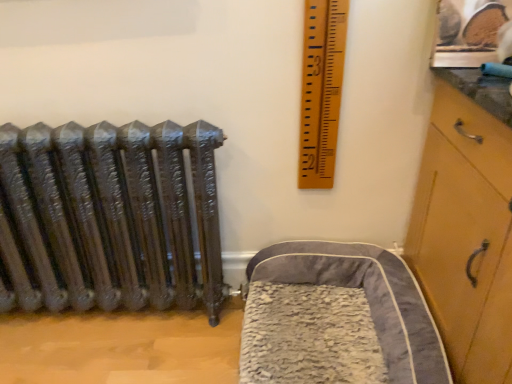
Question: From their relative heights in the image, would you say gray plush pet bed at lower right is taller or shorter than wooden ruler at upper right?

Choices:
 (A) short
 (B) tall

Answer: (A)

Question: Does point (415, 337) appear closer or farther from the camera than point (322, 18)?

Choices:
 (A) closer
 (B) farther

Answer: (B)

Question: From a real-world perspective, is gray plush pet bed at lower right positioned above or below wooden ruler at upper right?

Choices:
 (A) above
 (B) below

Answer: (B)

Question: Considering the positions of point tap(307, 170) and point tap(411, 291), is point tap(307, 170) closer or farther from the camera than point tap(411, 291)?

Choices:
 (A) closer
 (B) farther

Answer: (B)

Question: In the image, is wooden ruler at upper right on the left side or the right side of gray plush pet bed at lower right?

Choices:
 (A) right
 (B) left

Answer: (B)

Question: Is wooden ruler at upper right bigger or smaller than gray plush pet bed at lower right?

Choices:
 (A) small
 (B) big

Answer: (A)

Question: Which is correct: wooden ruler at upper right is inside gray plush pet bed at lower right, or outside of it?

Choices:
 (A) inside
 (B) outside

Answer: (B)